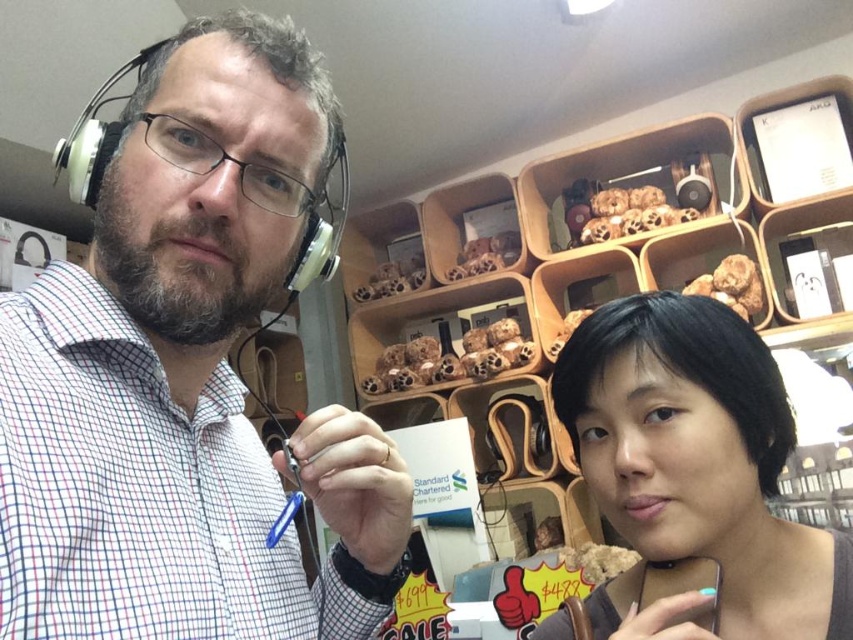
Between white checkered shirt at left and black matte hair at center, which one appears on the right side from the viewer's perspective?

Positioned to the right is black matte hair at center.

Who is more forward, (170, 118) or (646, 544)?

Positioned in front is point (170, 118).

The width and height of the screenshot is (853, 640). Identify the location of white checkered shirt at left. (165, 358).